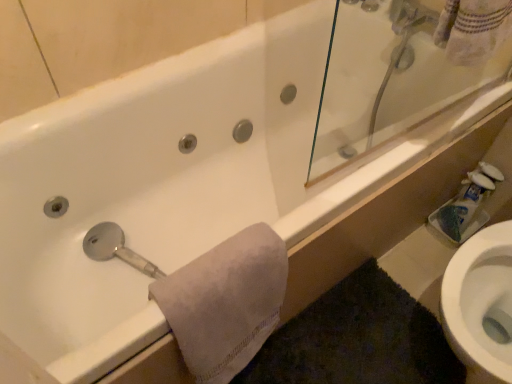
This screenshot has height=384, width=512. Describe the element at coordinates (464, 208) in the screenshot. I see `white matte toilet paper at right` at that location.

Locate an element on the screen. Image resolution: width=512 pixels, height=384 pixels. white matte toilet paper at right is located at coordinates (464, 208).

Locate an element on the screen. The width and height of the screenshot is (512, 384). white soft towel at lower left is located at coordinates (225, 302).

Measure the distance between point (271, 234) and camera.

83.30 centimeters.

What do you see at coordinates (225, 302) in the screenshot? Image resolution: width=512 pixels, height=384 pixels. I see `white soft towel at lower left` at bounding box center [225, 302].

Image resolution: width=512 pixels, height=384 pixels. Find the location of `white matte toilet paper at right`. white matte toilet paper at right is located at coordinates (464, 208).

Between white soft towel at lower left and white matte toilet paper at right, which one appears on the right side from the viewer's perspective?

white matte toilet paper at right.

In the image, is white soft towel at lower left positioned in front of or behind white matte toilet paper at right?

white soft towel at lower left is positioned closer to the viewer than white matte toilet paper at right.

Based on the photo, which point is more forward, [276,307] or [471,207]?

Point [276,307]

From the image's perspective, which one is positioned higher, white soft towel at lower left or white matte toilet paper at right?

white matte toilet paper at right.

From a real-world perspective, who is located higher, white soft towel at lower left or white matte toilet paper at right?

white soft towel at lower left, from a real-world perspective.

Which of these two, white soft towel at lower left or white matte toilet paper at right, is wider?

Wider between the two is white soft towel at lower left.

Who is shorter, white soft towel at lower left or white matte toilet paper at right?

With less height is white matte toilet paper at right.

Considering the sizes of objects white soft towel at lower left and white matte toilet paper at right in the image provided, who is smaller, white soft towel at lower left or white matte toilet paper at right?

Smaller between the two is white matte toilet paper at right.

Is white matte toilet paper at right surrounded by white soft towel at lower left?

That's incorrect, white matte toilet paper at right is not inside white soft towel at lower left.

Is white soft towel at lower left far from white matte toilet paper at right?

No, white soft towel at lower left is not far away from white matte toilet paper at right.

Could you tell me if white soft towel at lower left is facing white matte toilet paper at right?

No, white soft towel at lower left is not aimed at white matte toilet paper at right.

Locate an element on the screen. The image size is (512, 384). bath towel on the left of white matte toilet paper at right is located at coordinates (225, 302).

Considering the positions of objects white matte toilet paper at right and white soft towel at lower left in the image provided, who is more to the right, white matte toilet paper at right or white soft towel at lower left?

white matte toilet paper at right is more to the right.

Which object is further away from the camera, white matte toilet paper at right or white soft towel at lower left?

white matte toilet paper at right.

Looking at this image, which point is more distant from viewer, (456, 234) or (255, 280)?

The point (456, 234) is behind.

From the image's perspective, between white matte toilet paper at right and white soft towel at lower left, which one is located above?

white matte toilet paper at right.

From a real-world perspective, is white matte toilet paper at right above or below white soft towel at lower left?

white matte toilet paper at right is below white soft towel at lower left.

Is white matte toilet paper at right wider or thinner than white soft towel at lower left?

In the image, white matte toilet paper at right appears to be more narrow than white soft towel at lower left.

Based on the photo, considering the sizes of white matte toilet paper at right and white soft towel at lower left in the image, is white matte toilet paper at right taller or shorter than white soft towel at lower left?

Considering their sizes, white matte toilet paper at right has less height than white soft towel at lower left.

Does white matte toilet paper at right have a larger size compared to white soft towel at lower left?

Incorrect, white matte toilet paper at right is not larger than white soft towel at lower left.

From the picture: Is white matte toilet paper at right situated inside white soft towel at lower left or outside?

white matte toilet paper at right lies outside white soft towel at lower left.

Is white matte toilet paper at right placed right next to white soft towel at lower left?

white matte toilet paper at right and white soft towel at lower left are clearly separated.

Is white soft towel at lower left at the back of white matte toilet paper at right?

That's not correct — white matte toilet paper at right is not looking away from white soft towel at lower left.

How far apart are white matte toilet paper at right and white soft towel at lower left?

white matte toilet paper at right and white soft towel at lower left are 35.42 inches apart from each other.

Identify the location of toilet paper to the right of white soft towel at lower left. (464, 208).

Find the location of a particular element. bath towel below the white matte toilet paper at right (from the image's perspective) is located at coordinates (225, 302).

You are a GUI agent. You are given a task and a screenshot of the screen. Output one action in this format:
    pyautogui.click(x=<x>, y=<y>)
    Task: Click on the toilet paper above the white soft towel at lower left (from the image's perspective)
    The width and height of the screenshot is (512, 384).
    Given the screenshot: What is the action you would take?
    pyautogui.click(x=464, y=208)